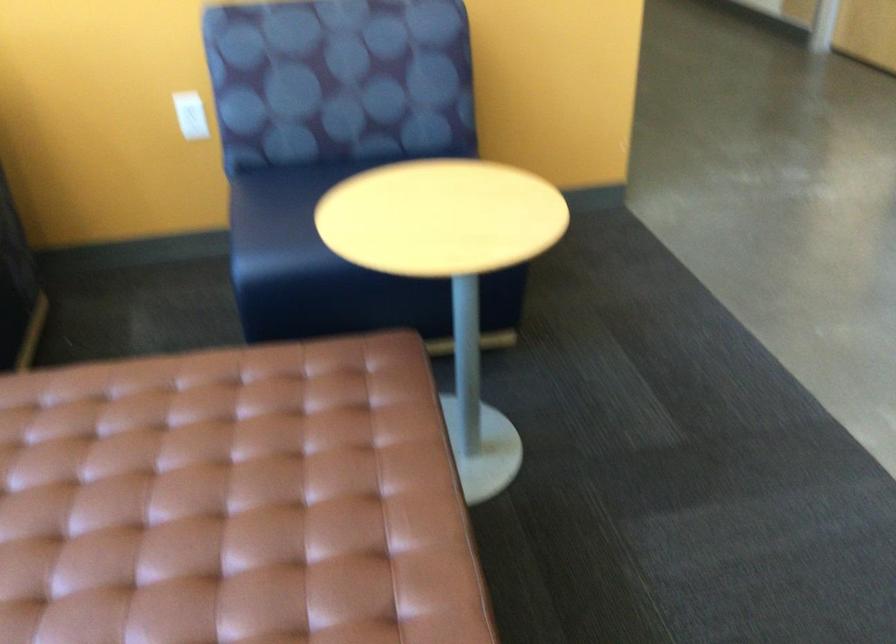
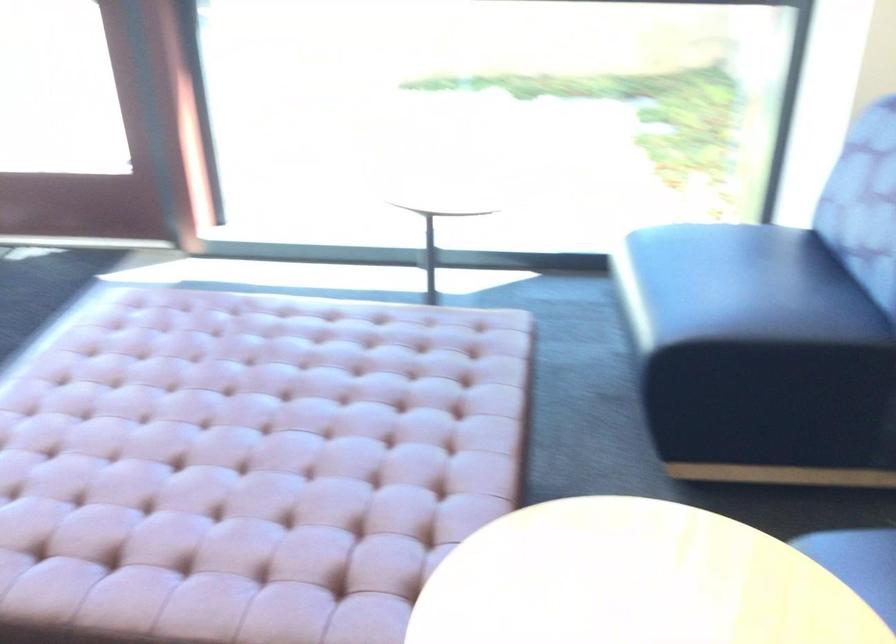
Locate, in the second image, the point that corresponds to (90,487) in the first image.

(306, 406)